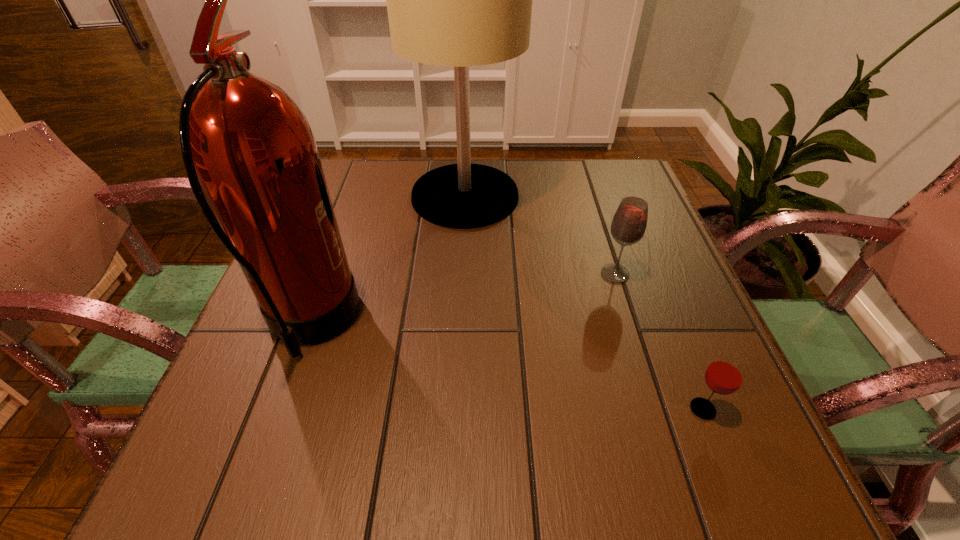
This screenshot has height=540, width=960. What are the coordinates of `free space located on the left of the nearer glass` in the screenshot? It's located at (550, 409).

You are a GUI agent. You are given a task and a screenshot of the screen. Output one action in this format:
    pyautogui.click(x=<x>, y=<y>)
    Task: Click on the object present at the far edge
    The image size is (960, 540).
    Given the screenshot: What is the action you would take?
    pyautogui.click(x=459, y=0)

Locate an element on the screen. The image size is (960, 540). object at the left edge is located at coordinates (244, 141).

Where is `free region at the far edge of the desktop`? free region at the far edge of the desktop is located at coordinates (525, 164).

Locate an element on the screen. blank space at the near edge is located at coordinates (446, 442).

In the image, there is a desktop. At what (x,y) coordinates should I click in order to perform the action: click on free space at the left edge. Please return your answer as a coordinate pair (x, y). Looking at the image, I should click on (283, 347).

I want to click on vacant space at the right edge of the desktop, so click(624, 297).

Where is `free space at the far left corner of the desktop`? This screenshot has height=540, width=960. free space at the far left corner of the desktop is located at coordinates (383, 170).

In the image, there is a desktop. At what (x,y) coordinates should I click in order to perform the action: click on vacant area at the near left corner. Please return your answer as a coordinate pair (x, y). This screenshot has height=540, width=960. Looking at the image, I should click on (213, 471).

The image size is (960, 540). In the image, there is a desktop. Find the location of `vacant space at the far right corner`. vacant space at the far right corner is located at coordinates (613, 197).